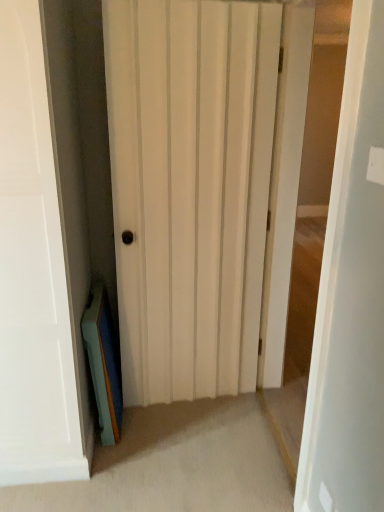
Question: From a real-world perspective, is white wood door at center, the second door viewed from the left, located higher than teal matte book at lower left?

Choices:
 (A) yes
 (B) no

Answer: (A)

Question: Considering the relative sizes of white wood door at center, the 1th door when ordered from right to left, and teal matte book at lower left in the image provided, is white wood door at center, the 1th door when ordered from right to left, shorter than teal matte book at lower left?

Choices:
 (A) yes
 (B) no

Answer: (B)

Question: Does white wood door at center, the second door viewed from the left, lie behind teal matte book at lower left?

Choices:
 (A) yes
 (B) no

Answer: (B)

Question: From a real-world perspective, is white wood door at center, the 1th door when ordered from right to left, below teal matte book at lower left?

Choices:
 (A) no
 (B) yes

Answer: (A)

Question: Does white wood door at center, the 1th door when ordered from right to left, have a greater height compared to teal matte book at lower left?

Choices:
 (A) no
 (B) yes

Answer: (B)

Question: Does white wood door at center, the second door viewed from the left, contain teal matte book at lower left?

Choices:
 (A) yes
 (B) no

Answer: (B)

Question: Does white matte door at center, the 1th door in the left-to-right sequence, contain white wood door at center, the second door viewed from the left?

Choices:
 (A) yes
 (B) no

Answer: (B)

Question: Considering the relative sizes of white matte door at center, the second door viewed from the right, and white wood door at center, the 1th door when ordered from right to left, in the image provided, is white matte door at center, the second door viewed from the right, wider than white wood door at center, the 1th door when ordered from right to left,?

Choices:
 (A) yes
 (B) no

Answer: (B)

Question: Is white matte door at center, the 1th door in the left-to-right sequence, at the right side of white wood door at center, the 1th door when ordered from right to left?

Choices:
 (A) yes
 (B) no

Answer: (B)

Question: Can you confirm if white matte door at center, the second door viewed from the right, is smaller than white wood door at center, the 1th door when ordered from right to left?

Choices:
 (A) no
 (B) yes

Answer: (B)

Question: Is white matte door at center, the second door viewed from the right, facing towards white wood door at center, the second door viewed from the left?

Choices:
 (A) no
 (B) yes

Answer: (B)

Question: Is white matte door at center, the 1th door in the left-to-right sequence, thinner than white wood door at center, the second door viewed from the left?

Choices:
 (A) no
 (B) yes

Answer: (B)

Question: Considering the relative sizes of teal matte book at lower left and white wood door at center, the second door viewed from the left, in the image provided, is teal matte book at lower left shorter than white wood door at center, the second door viewed from the left,?

Choices:
 (A) no
 (B) yes

Answer: (B)